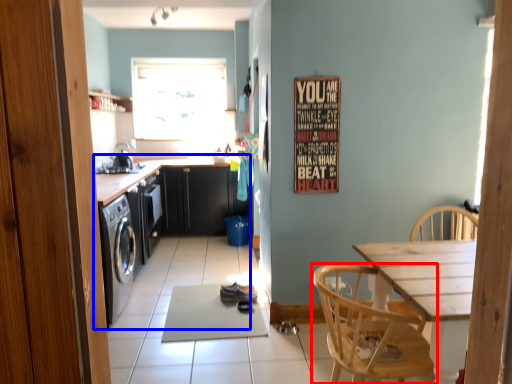
Question: Which point is closer to the camera, chair (highlighted by a red box) or cabinetry (highlighted by a blue box)?

Choices:
 (A) chair
 (B) cabinetry

Answer: (A)